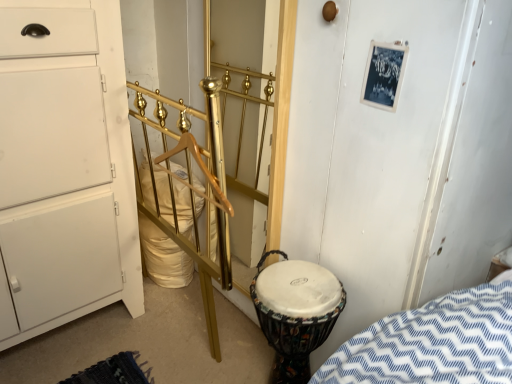
Question: Looking at the image, does gold polished metal rail at center seem bigger or smaller compared to multicolored fabric drum at lower right?

Choices:
 (A) small
 (B) big

Answer: (B)

Question: Is gold polished metal rail at center in front of or behind multicolored fabric drum at lower right in the image?

Choices:
 (A) front
 (B) behind

Answer: (A)

Question: Which object is positioned closest to the white matte chest of drawers at left?

Choices:
 (A) gold polished metal rail at center
 (B) gold metallic door at center
 (C) multicolored fabric drum at lower right

Answer: (A)

Question: Based on their relative distances, which object is nearer to the multicolored fabric drum at lower right?

Choices:
 (A) gold polished metal rail at center
 (B) gold metallic door at center
 (C) white matte chest of drawers at left

Answer: (A)